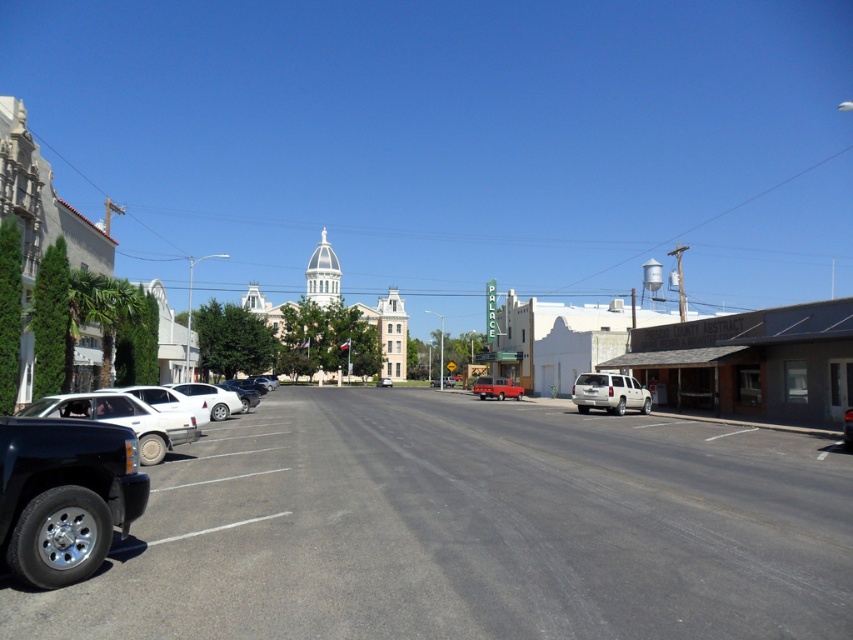
You are standing on the sidewalk in front of the Palace building. You need to cross the street to reach the COUNTY ABSTRACT office. The road you need to cross has a matte black truck at left parked on it. Can you safely cross the road without going around the truck?

The matte black truck at left is 40.04 feet from the viewer. Since the truck is parked on the road, you can safely cross the road as long as there is enough space between the truck and other vehicles or the edge of the road. However, the exact safety depends on traffic conditions not specified here.

You are a delivery driver who needs to park your vehicle between the two buildings on the right side of the street. You see a matte white truck at center and a metallic silver sedan at center. Which vehicle should you park behind to ensure you are closest to the COUNTY ABSTRACT building?

You should park behind the metallic silver sedan at center because the matte white truck at center is to the right of the metallic silver sedan at center, meaning the sedan is closer to the COUNTY ABSTRACT building.